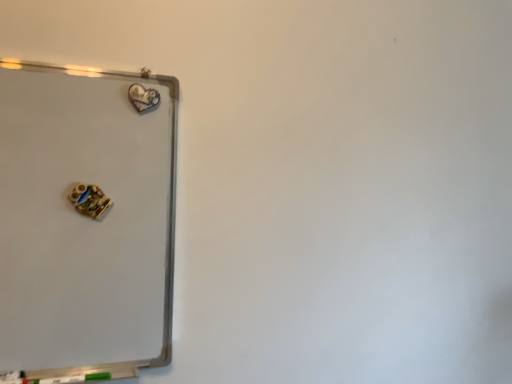
The image size is (512, 384). Identify the location of white glossy whiteboard at upper left. (85, 221).

In order to face white glossy whiteboard at upper left, should I rotate leftwards or rightwards?

Turn left approximately 20.986 degrees to face it.

The height and width of the screenshot is (384, 512). What do you see at coordinates (85, 221) in the screenshot?
I see `white glossy whiteboard at upper left` at bounding box center [85, 221].

Identify the location of white glossy whiteboard at upper left. tap(85, 221).